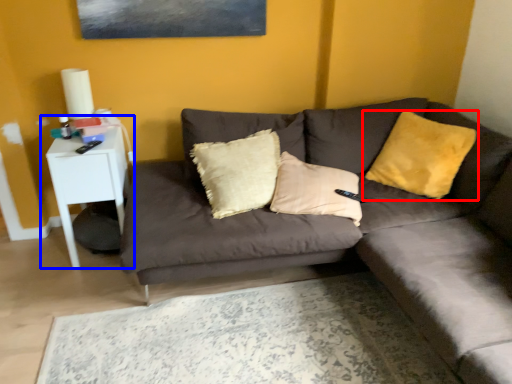
Question: Which object appears closest to the camera in this image, pillow (highlighted by a red box) or table (highlighted by a blue box)?

Choices:
 (A) pillow
 (B) table

Answer: (A)